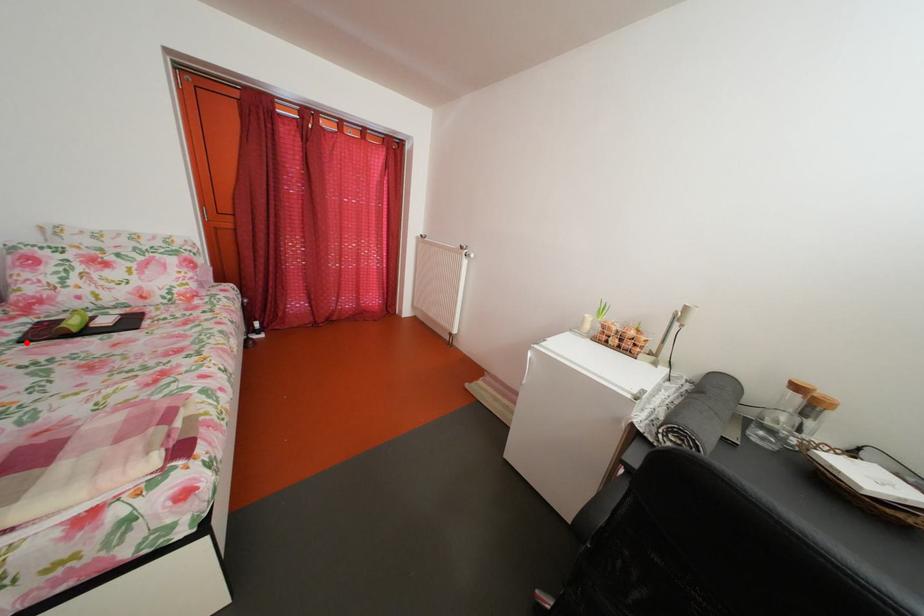
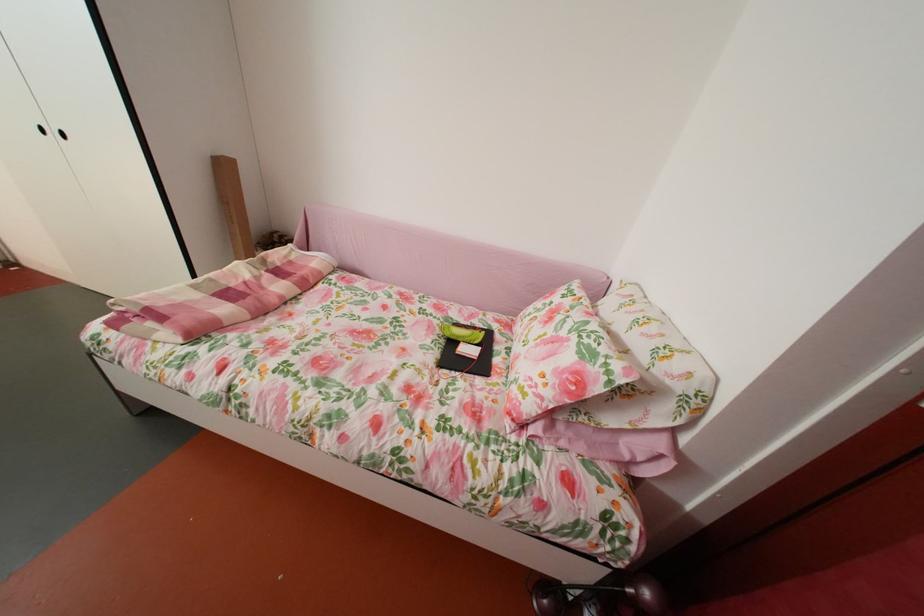
Where in the second image is the point corresponding to the highlighted location from the first image?

(473, 328)